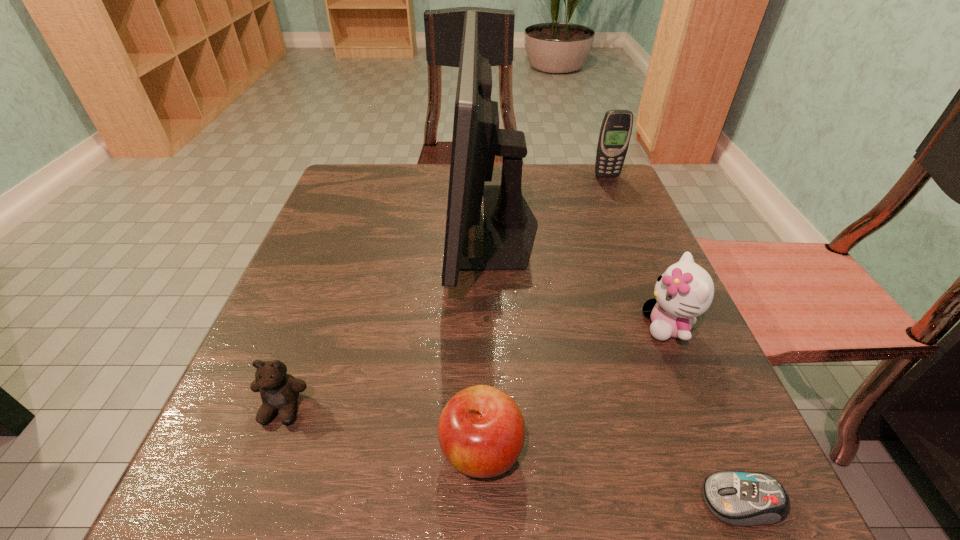
Image resolution: width=960 pixels, height=540 pixels. Identify the location of free spot located on the front-facing side of the kitten. (434, 326).

Locate an element on the screen. free space located 0.120m on the front-facing side of the kitten is located at coordinates (573, 326).

Where is `vacant space located on the front-facing side of the kitten`? Image resolution: width=960 pixels, height=540 pixels. vacant space located on the front-facing side of the kitten is located at coordinates (492, 326).

The height and width of the screenshot is (540, 960). What are the coordinates of `vacant space located on the back of the apple` in the screenshot? It's located at (481, 374).

Where is `free space located on the face of the leftmost object`? free space located on the face of the leftmost object is located at coordinates (241, 520).

Identify the location of free point located 0.170m on the wheel side of the computer mouse. The image size is (960, 540). (564, 501).

You are a GUI agent. You are given a task and a screenshot of the screen. Output one action in this format:
    pyautogui.click(x=<x>, y=<y>)
    Task: Click on the free spot located 0.110m on the wheel side of the computer mouse
    This screenshot has height=540, width=960.
    Given the screenshot: What is the action you would take?
    pyautogui.click(x=613, y=501)

Locate an element on the screen. This screenshot has width=960, height=540. free space located 0.250m on the wheel side of the computer mouse is located at coordinates (500, 501).

Where is `computer monitor located at the far edge`? computer monitor located at the far edge is located at coordinates (510, 226).

The width and height of the screenshot is (960, 540). In order to click on cellular telephone present at the far edge in this screenshot , I will do `click(616, 128)`.